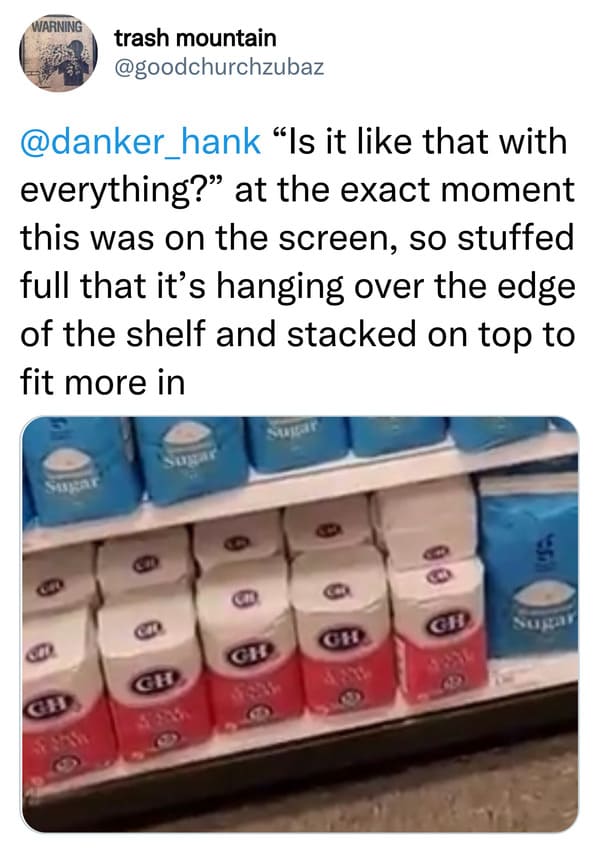
Find the location of a particular element. floor is located at coordinates (423, 803).